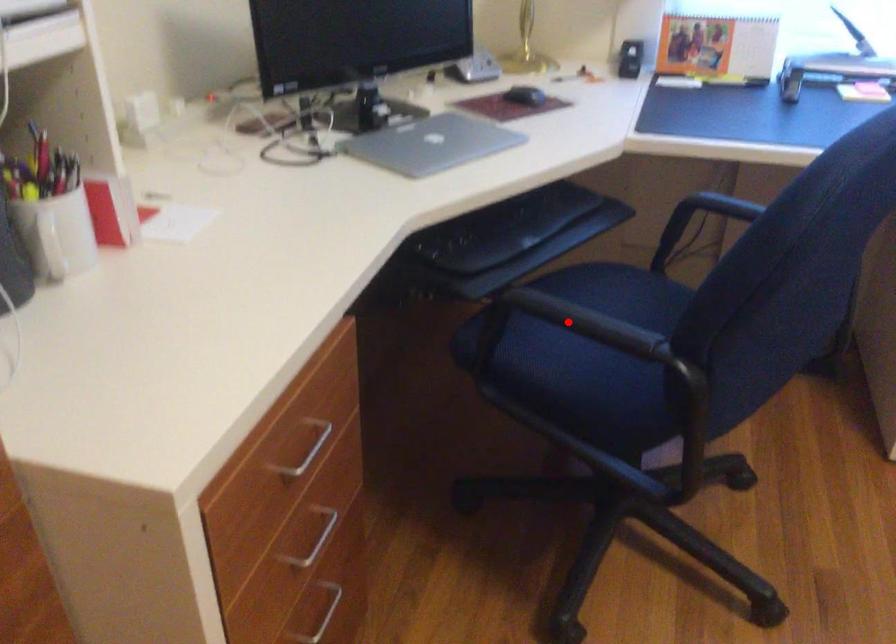
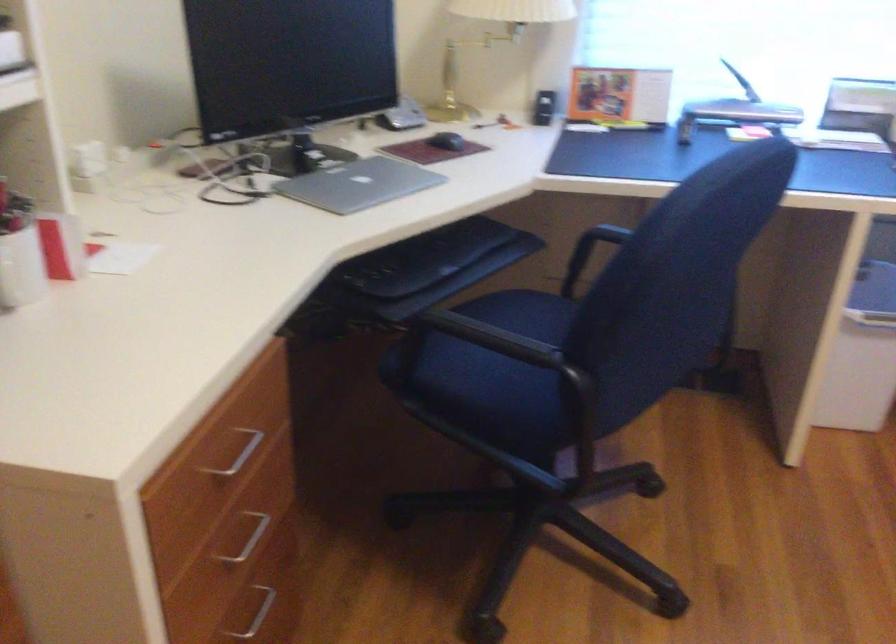
Locate, in the second image, the point that corresponds to the highlighted location in the first image.

(478, 339)